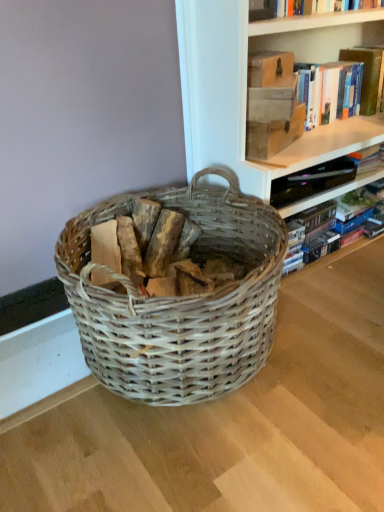
Find the location of a particular element. The width and height of the screenshot is (384, 512). free space to the right of woven wood basket at center is located at coordinates (334, 324).